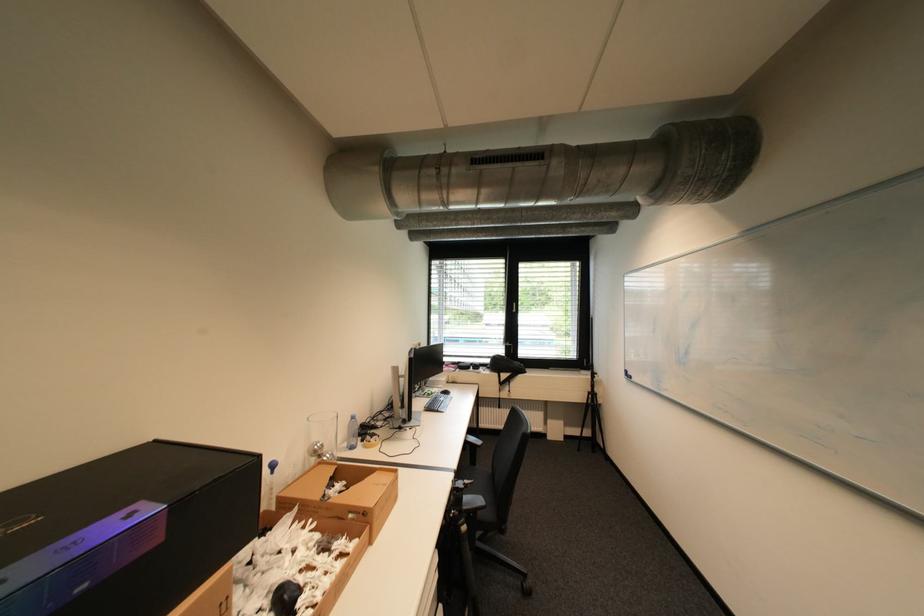
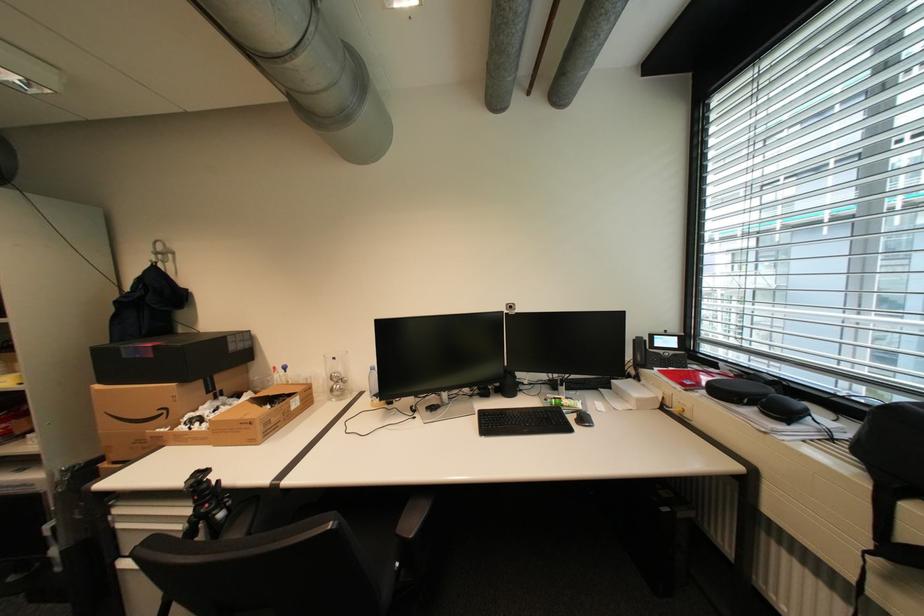
The point at (x=171, y=541) is marked in the first image. Where is the corresponding point in the second image?

(161, 357)